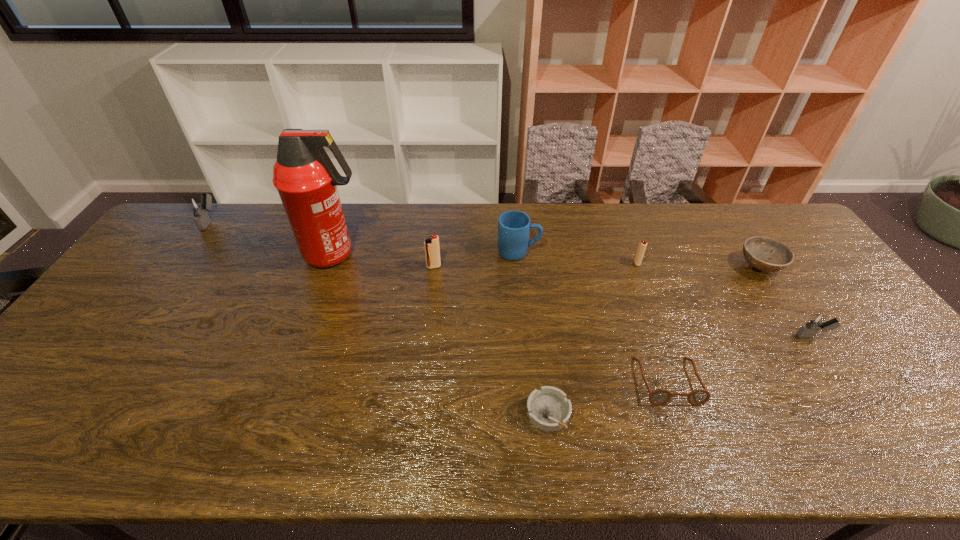
Find the location of a particular element. vacant point located between the spectacles and the bigger red igniter is located at coordinates (551, 323).

This screenshot has width=960, height=540. I want to click on empty space between the leftmost object and the ashtray, so click(379, 317).

You are a GUI agent. You are given a task and a screenshot of the screen. Output one action in this format:
    pyautogui.click(x=<x>, y=<y>)
    Task: Click on the vacant region between the spectacles and the third nearest object
    This screenshot has width=960, height=540.
    Given the screenshot: What is the action you would take?
    pyautogui.click(x=740, y=359)

The width and height of the screenshot is (960, 540). In order to click on unoccupied area between the bigger red igniter and the brown bowl in this screenshot , I will do `click(597, 267)`.

Locate an element on the screen. This screenshot has height=540, width=960. empty location between the eighth object from right to left and the bigger red igniter is located at coordinates (385, 261).

Image resolution: width=960 pixels, height=540 pixels. Find the location of `vacant space in between the blue mug and the right red igniter`. vacant space in between the blue mug and the right red igniter is located at coordinates pos(578,258).

Where is `vacant region between the third igniter from left to right and the fire extinguisher`? Image resolution: width=960 pixels, height=540 pixels. vacant region between the third igniter from left to right and the fire extinguisher is located at coordinates (486, 259).

Locate an element on the screen. This screenshot has height=540, width=960. free spot between the tallest object and the spectacles is located at coordinates [501, 318].

Select which object is the eighth closest to the right red igniter. Please provide its 2D coordinates. Your answer should be formatted as a tuple, i.e. [(x, y)], where the tuple contains the x and y coordinates of a point satisfying the conditions above.

[(199, 206)]

Choose which object is the seventh nearest neighbor to the right red igniter. Please provide its 2D coordinates. Your answer should be formatted as a tuple, i.e. [(x, y)], where the tuple contains the x and y coordinates of a point satisfying the conditions above.

[(306, 179)]